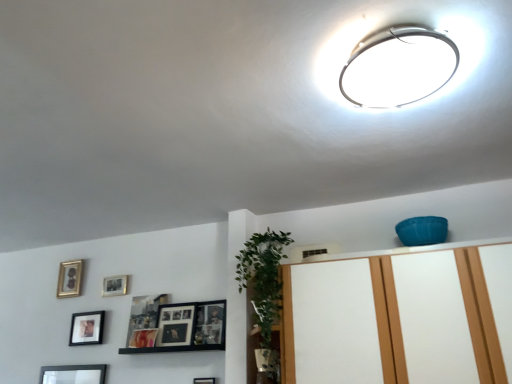
Question: From a real-world perspective, is black matte picture frame at lower center, positioned as the 5th picture frame in back-to-front order, beneath white glossy dresser at upper center?

Choices:
 (A) no
 (B) yes

Answer: (B)

Question: Can you confirm if black matte picture frame at lower center, positioned as the 5th picture frame in back-to-front order, is positioned to the left of white glossy dresser at upper center?

Choices:
 (A) yes
 (B) no

Answer: (A)

Question: Is black matte picture frame at lower center, the 1th picture frame when ordered from right to left, outside of white glossy dresser at upper center?

Choices:
 (A) no
 (B) yes

Answer: (B)

Question: Could you tell me if black matte picture frame at lower center, positioned as the 5th picture frame in back-to-front order, is facing white glossy dresser at upper center?

Choices:
 (A) yes
 (B) no

Answer: (B)

Question: Is matte black picture frame at center left, the second picture frame from the front, wider or thinner than white glossy dresser at upper center?

Choices:
 (A) wide
 (B) thin

Answer: (B)

Question: From a real-world perspective, relative to white glossy dresser at upper center, is matte black picture frame at center left, the fourth picture frame from the left, vertically above or below?

Choices:
 (A) above
 (B) below

Answer: (A)

Question: Is matte black picture frame at center left, the second picture frame from the front, spatially inside white glossy dresser at upper center, or outside of it?

Choices:
 (A) outside
 (B) inside

Answer: (A)

Question: From the image's perspective, is matte black picture frame at center left, which is counted as the fourth picture frame, starting from the back, above or below white glossy dresser at upper center?

Choices:
 (A) below
 (B) above

Answer: (A)

Question: Based on their sizes in the image, would you say black matte picture frame at lower center, positioned as the fifth picture frame in left-to-right order, is bigger or smaller than green leafy plant at center?

Choices:
 (A) small
 (B) big

Answer: (A)

Question: Is black matte picture frame at lower center, the 1th picture frame when ordered from right to left, wider or thinner than green leafy plant at center?

Choices:
 (A) wide
 (B) thin

Answer: (B)

Question: In terms of height, does black matte picture frame at lower center, which is the 1th picture frame from front to back, look taller or shorter compared to green leafy plant at center?

Choices:
 (A) short
 (B) tall

Answer: (A)

Question: Considering the positions of point (212, 379) and point (267, 283), is point (212, 379) closer or farther from the camera than point (267, 283)?

Choices:
 (A) farther
 (B) closer

Answer: (A)

Question: From the image's perspective, relative to matte black picture frame at center left, the second picture frame from the front, is green leafy plant at center above or below?

Choices:
 (A) above
 (B) below

Answer: (A)

Question: From their relative heights in the image, would you say green leafy plant at center is taller or shorter than matte black picture frame at center left, which is counted as the fourth picture frame, starting from the back?

Choices:
 (A) short
 (B) tall

Answer: (B)